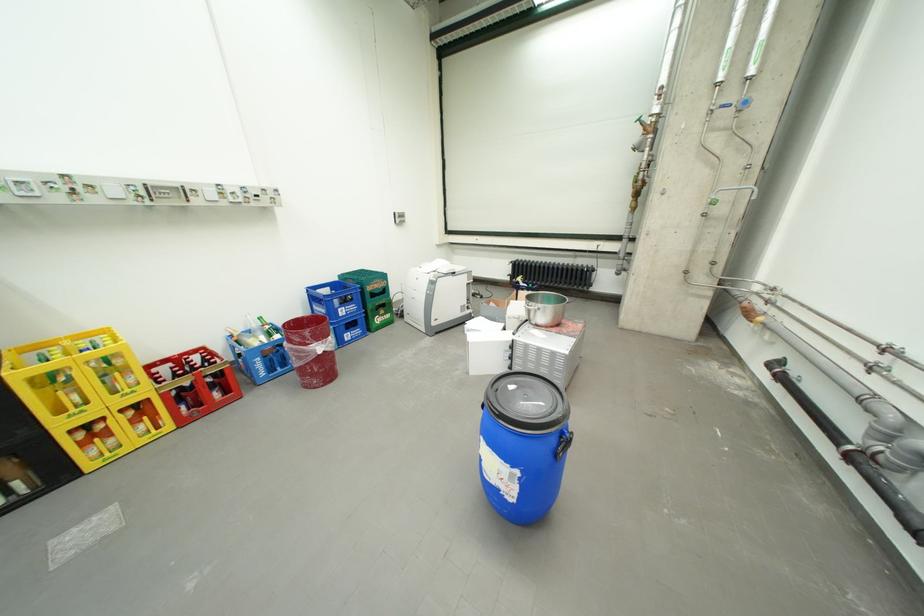
Find where to lift the white cardboard box. Please return your answer as a coordinate pair (x, y).

(488, 352)